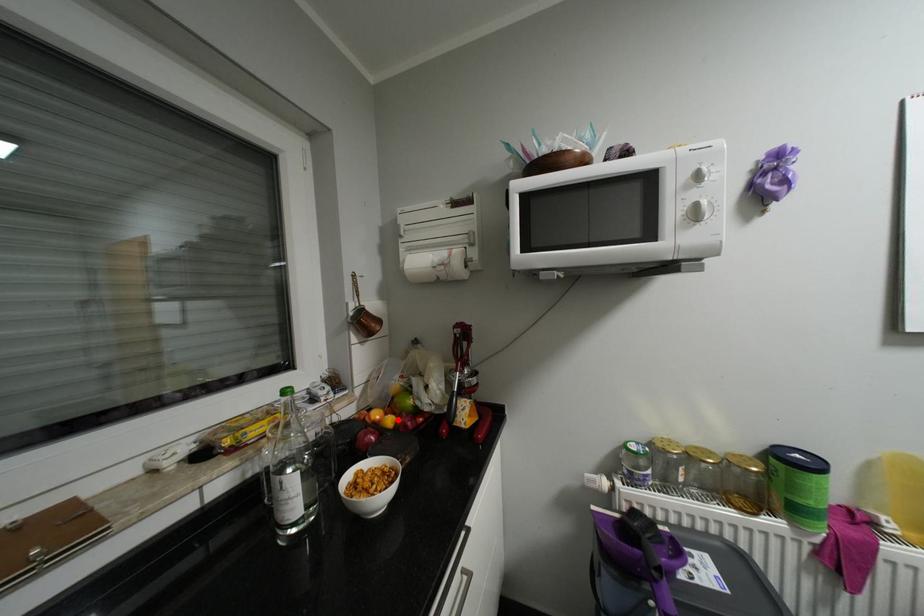
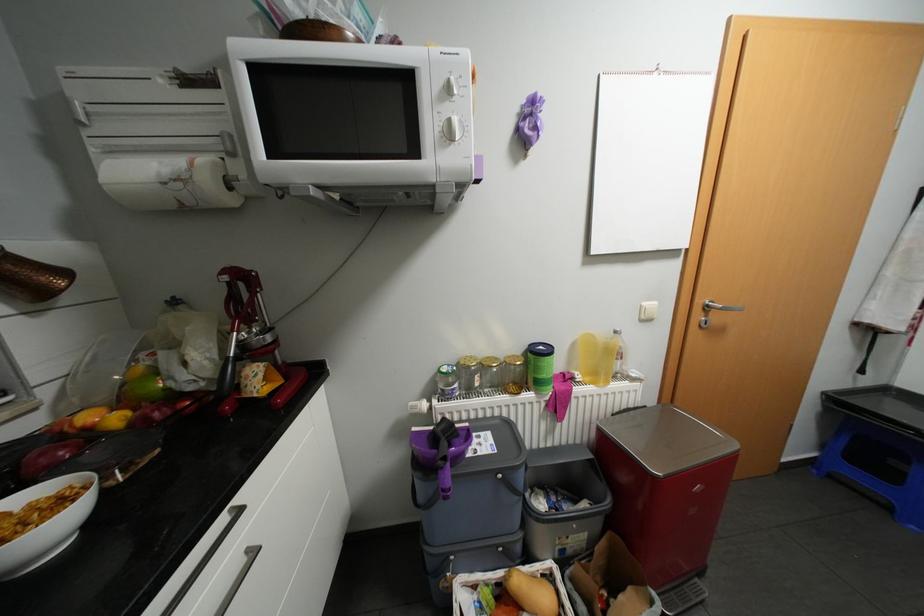
In the second image, find the point that corresponds to the highlighted location in the first image.

(123, 418)